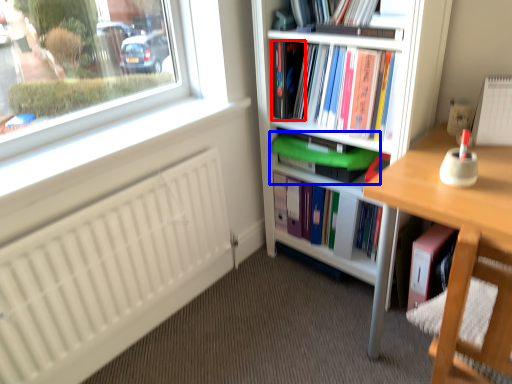
Question: Which of the following is the closest to the observer, paperback book (highlighted by a red box) or book (highlighted by a blue box)?

Choices:
 (A) paperback book
 (B) book

Answer: (B)